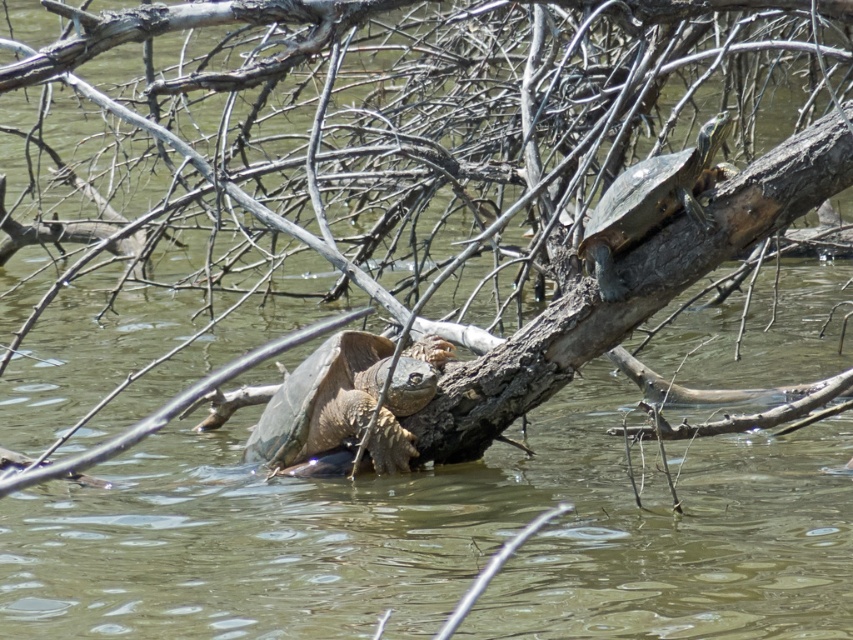
Question: Can you confirm if leathery brown tortoise at center is thinner than smooth brown tortoise at upper right?

Choices:
 (A) no
 (B) yes

Answer: (A)

Question: Which object is closer to the camera taking this photo?

Choices:
 (A) leathery brown tortoise at center
 (B) smooth brown tortoise at upper right

Answer: (B)

Question: Can you confirm if leathery brown tortoise at center is wider than smooth brown tortoise at upper right?

Choices:
 (A) yes
 (B) no

Answer: (A)

Question: Can you confirm if leathery brown tortoise at center is positioned to the right of smooth brown tortoise at upper right?

Choices:
 (A) yes
 (B) no

Answer: (B)

Question: Which object is closer to the camera taking this photo?

Choices:
 (A) leathery brown tortoise at center
 (B) smooth brown tortoise at upper right

Answer: (B)